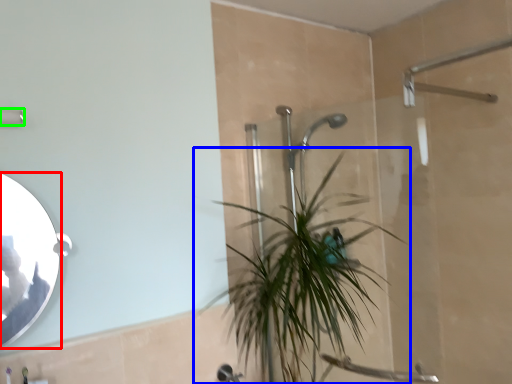
Question: Which is farther away from mirror (highlighted by a red box)? houseplant (highlighted by a blue box) or shower (highlighted by a green box)?

Choices:
 (A) houseplant
 (B) shower

Answer: (A)